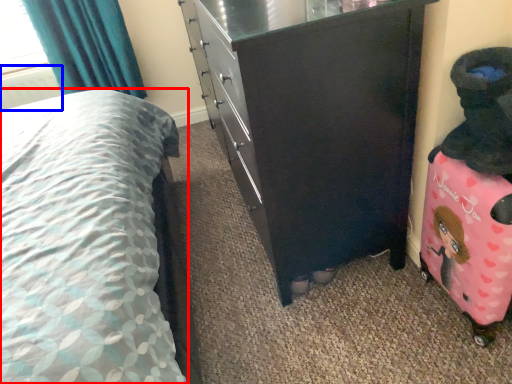
Question: Which point is closer to the camera, bed (highlighted by a red box) or radiator (highlighted by a blue box)?

Choices:
 (A) bed
 (B) radiator

Answer: (A)